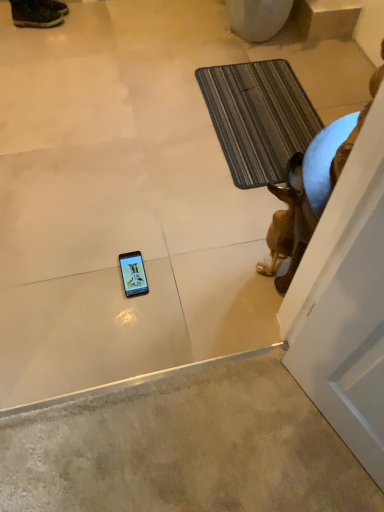
This screenshot has width=384, height=512. Describe the element at coordinates (38, 13) in the screenshot. I see `leather brown boot at upper left` at that location.

Where is `leather brown boot at upper left`? The image size is (384, 512). leather brown boot at upper left is located at coordinates (38, 13).

Considering the points (285, 239) and (220, 88), which point is in front, point (285, 239) or point (220, 88)?

The point (285, 239) is in front.

Is brown glossy statue at right turned away from striped fabric bath mat at upper right?

No, striped fabric bath mat at upper right is not at the back of brown glossy statue at right.

Does brown glossy statue at right come in front of striped fabric bath mat at upper right?

Yes, it is.

From the image's perspective, is brown glossy statue at right above or below striped fabric bath mat at upper right?

Clearly, from the image's perspective, brown glossy statue at right is below striped fabric bath mat at upper right.

From a real-world perspective, is brown glossy statue at right below leather brown boot at upper left?

Incorrect, from a real-world perspective, brown glossy statue at right is higher than leather brown boot at upper left.

Is brown glossy statue at right bigger than leather brown boot at upper left?

Yes.

Considering the relative sizes of brown glossy statue at right and leather brown boot at upper left in the image provided, is brown glossy statue at right taller than leather brown boot at upper left?

Correct, brown glossy statue at right is much taller as leather brown boot at upper left.

Is the depth of leather brown boot at upper left greater than that of striped fabric bath mat at upper right?

Yes, it is.

Is leather brown boot at upper left not within striped fabric bath mat at upper right?

leather brown boot at upper left lies outside striped fabric bath mat at upper right's area.

Which is nearer, (36, 22) or (238, 118)?

Clearly, point (36, 22) is more distant from the camera than point (238, 118).

You are a GUI agent. You are given a task and a screenshot of the screen. Output one action in this format:
    pyautogui.click(x=<x>, y=<y>)
    Task: Click on the footwear behind the brown glossy statue at right
    Image resolution: width=384 pixels, height=512 pixels.
    Given the screenshot: What is the action you would take?
    pyautogui.click(x=38, y=13)

Is brown glossy statue at right completely or partially inside leather brown boot at upper left?

No.

From a real-world perspective, is leather brown boot at upper left physically above brown glossy statue at right?

No, from a real-world perspective, leather brown boot at upper left is not on top of brown glossy statue at right.

How different are the orientations of leather brown boot at upper left and brown glossy statue at right in degrees?

The angle between the facing direction of leather brown boot at upper left and the facing direction of brown glossy statue at right is 167 degrees.

How many degrees apart are the facing directions of striped fabric bath mat at upper right and leather brown boot at upper left?

They differ by 75 degrees in their facing directions.

Which of these two, striped fabric bath mat at upper right or leather brown boot at upper left, is bigger?

striped fabric bath mat at upper right is bigger.

Is striped fabric bath mat at upper right inside or outside of leather brown boot at upper left?

striped fabric bath mat at upper right lies outside leather brown boot at upper left.

Is striped fabric bath mat at upper right next to leather brown boot at upper left and touching it?

striped fabric bath mat at upper right and leather brown boot at upper left are clearly separated.

From the image's perspective, which is above, striped fabric bath mat at upper right or brown glossy statue at right?

striped fabric bath mat at upper right, from the image's perspective.

Is striped fabric bath mat at upper right facing away from brown glossy statue at right?

No.

Can you confirm if striped fabric bath mat at upper right is thinner than brown glossy statue at right?

No, striped fabric bath mat at upper right is not thinner than brown glossy statue at right.

Is the depth of striped fabric bath mat at upper right greater than that of brown glossy statue at right?

Yes, it is behind brown glossy statue at right.

The width and height of the screenshot is (384, 512). Identify the location of bath mat above the brown glossy statue at right (from the image's perspective). (258, 118).

This screenshot has width=384, height=512. What are the coordinates of `animal below the leather brown boot at upper left (from the image's perspective)` in the screenshot? It's located at (308, 196).

Which object lies further to the anchor point leather brown boot at upper left, brown glossy statue at right or striped fabric bath mat at upper right?

Based on the image, brown glossy statue at right appears to be further to leather brown boot at upper left.

Estimate the real-world distances between objects in this image. Which object is closer to striped fabric bath mat at upper right, leather brown boot at upper left or brown glossy statue at right?

brown glossy statue at right is closer to striped fabric bath mat at upper right.

Based on their spatial positions, is striped fabric bath mat at upper right or leather brown boot at upper left closer to brown glossy statue at right?

striped fabric bath mat at upper right lies closer to brown glossy statue at right than the other object.

Estimate the real-world distances between objects in this image. Which object is closer to striped fabric bath mat at upper right, brown glossy statue at right or leather brown boot at upper left?

Among the two, brown glossy statue at right is located nearer to striped fabric bath mat at upper right.

Looking at the image, which one is located closer to brown glossy statue at right, leather brown boot at upper left or striped fabric bath mat at upper right?

Based on the image, striped fabric bath mat at upper right appears to be nearer to brown glossy statue at right.

When comparing their distances from leather brown boot at upper left, does striped fabric bath mat at upper right or brown glossy statue at right seem further?

brown glossy statue at right lies further to leather brown boot at upper left than the other object.

Find the location of a particular element. bath mat between leather brown boot at upper left and brown glossy statue at right from left to right is located at coordinates (258, 118).